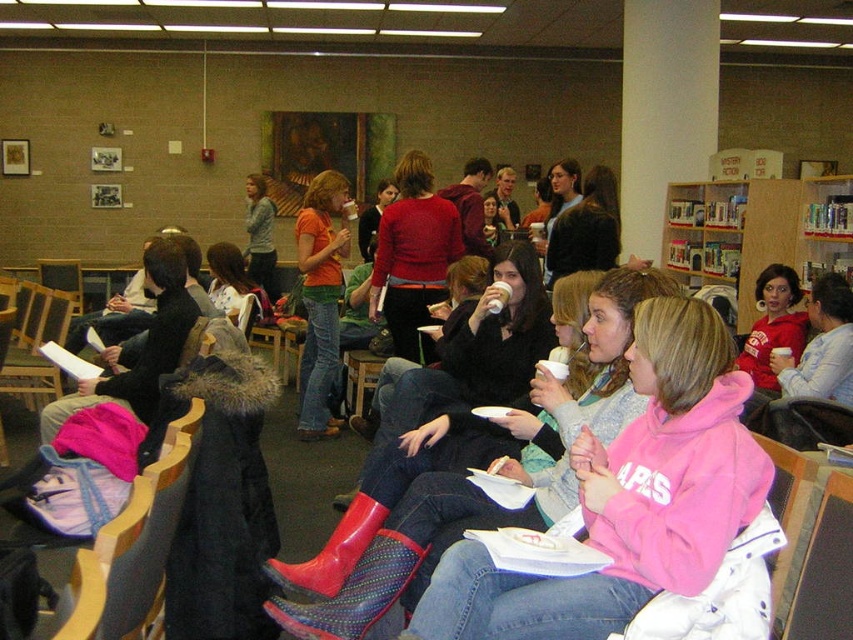
You are sitting at the point labeled point (386, 248) and want to walk to the exit located at point (762, 273). Is the exit behind you or in front of you?

The exit at point (762, 273) is behind you because point (386, 248) is in front of point (762, 273).

You are a person who wants to know if the pink fleece sweatshirt at center is taller than the wooden bookshelf at upper right. Based on the scene description, can you determine which one is taller?

The pink fleece sweatshirt at center is not as tall as the wooden bookshelf at upper right, so the wooden bookshelf at upper right is taller.